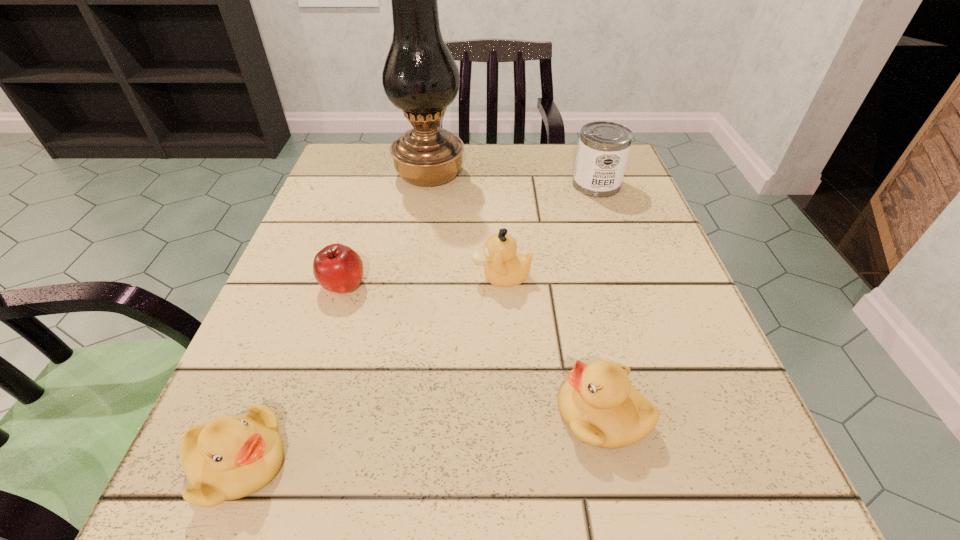
You are a GUI agent. You are given a task and a screenshot of the screen. Output one action in this format:
    pyautogui.click(x=<x>, y=<y>)
    Task: Click on the free location located on the face of the second duckling from right to left
    This screenshot has height=540, width=960.
    Given the screenshot: What is the action you would take?
    pyautogui.click(x=385, y=277)

What are the coordinates of `vacant area situated 0.130m on the face of the second duckling from right to left` in the screenshot? It's located at (396, 277).

The image size is (960, 540). Find the location of `vacant space located on the front-facing side of the rightmost duckling`. vacant space located on the front-facing side of the rightmost duckling is located at coordinates (513, 414).

I want to click on vacant space situated 0.380m on the front-facing side of the rightmost duckling, so click(269, 414).

At what (x,y) coordinates should I click in order to perform the action: click on vacant space located 0.290m on the front-facing side of the rightmost duckling. Please return your answer as a coordinate pair (x, y). The image size is (960, 540). Looking at the image, I should click on (338, 414).

The width and height of the screenshot is (960, 540). What are the coordinates of `blank space located on the back of the apple` in the screenshot? It's located at click(x=380, y=167).

Where is `vacant space situated at the face of the leftmost duckling`? This screenshot has width=960, height=540. vacant space situated at the face of the leftmost duckling is located at coordinates pyautogui.click(x=558, y=462).

At what (x,y) coordinates should I click in order to perform the action: click on oil lamp that is at the far edge. Please return your answer as a coordinate pair (x, y). Image resolution: width=960 pixels, height=540 pixels. Looking at the image, I should click on (420, 77).

Locate an element on the screen. The height and width of the screenshot is (540, 960). can located at the far edge is located at coordinates tap(603, 149).

The height and width of the screenshot is (540, 960). In order to click on oil lamp that is positioned at the left edge in this screenshot , I will do `click(420, 77)`.